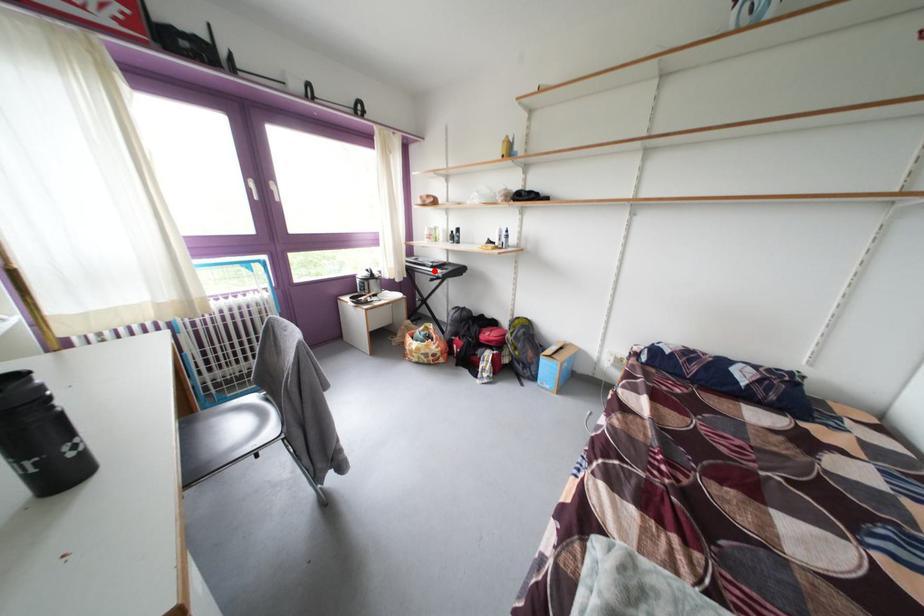
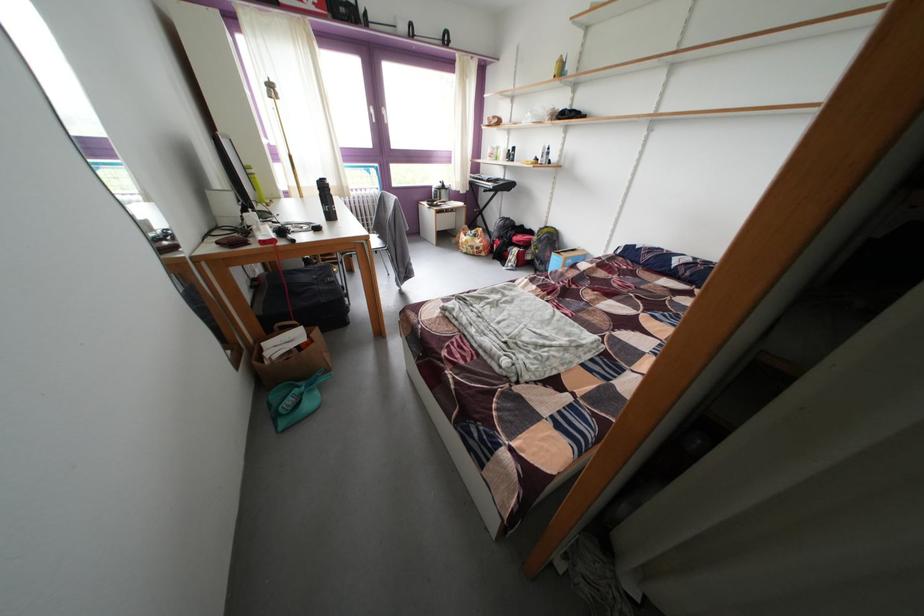
Question: I am providing you with two images of the same scene from different viewpoints. In image1, a red point is highlighted. Considering the same 3D point in image2, which of the following is correct?

Choices:
 (A) It is closer
 (B) It is farther

Answer: (A)